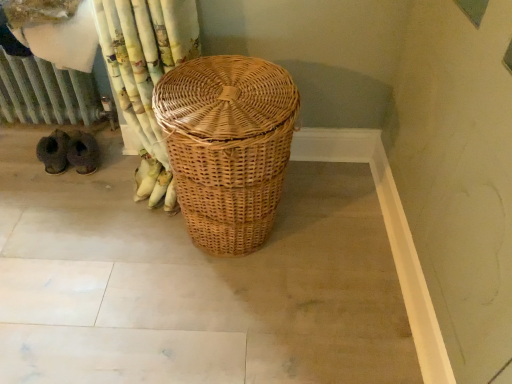
At what (x,y) coordinates should I click in order to perform the action: click on vacant area that is situated to the right of natural wicker basket at center. Please return your answer as a coordinate pair (x, y). The image size is (512, 384). Looking at the image, I should click on [x=331, y=230].